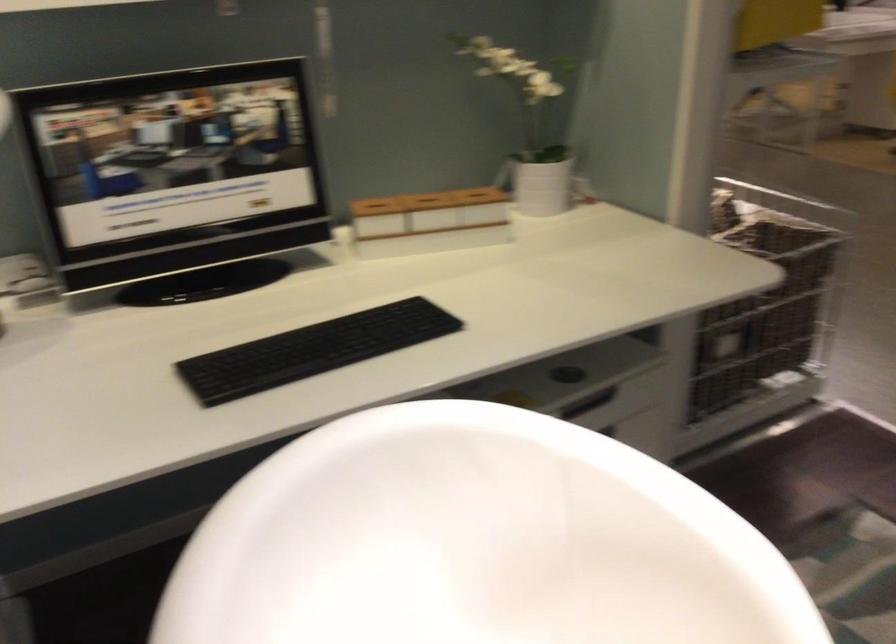
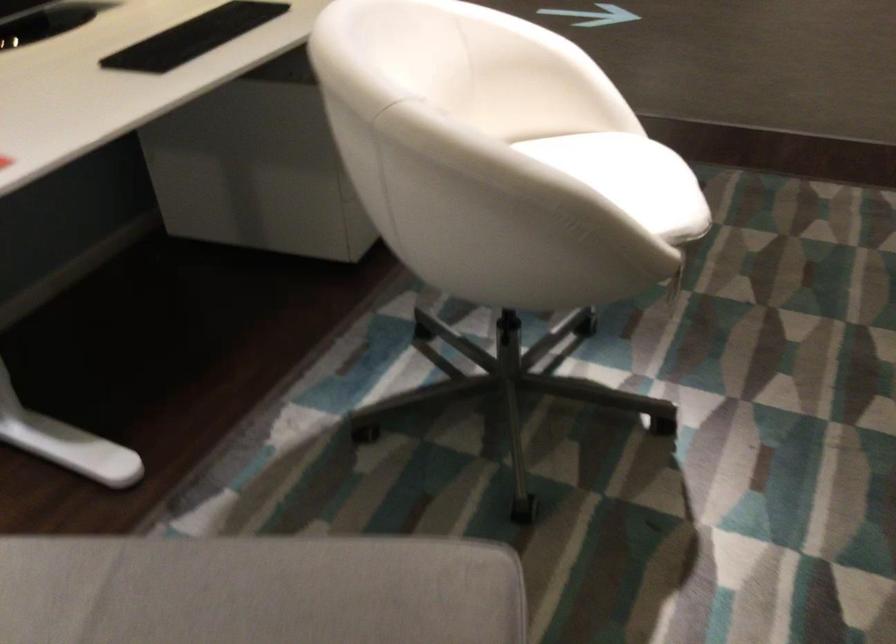
Question: How did the camera likely rotate?

Choices:
 (A) Left
 (B) Right
 (C) Up
 (D) Down

Answer: (B)